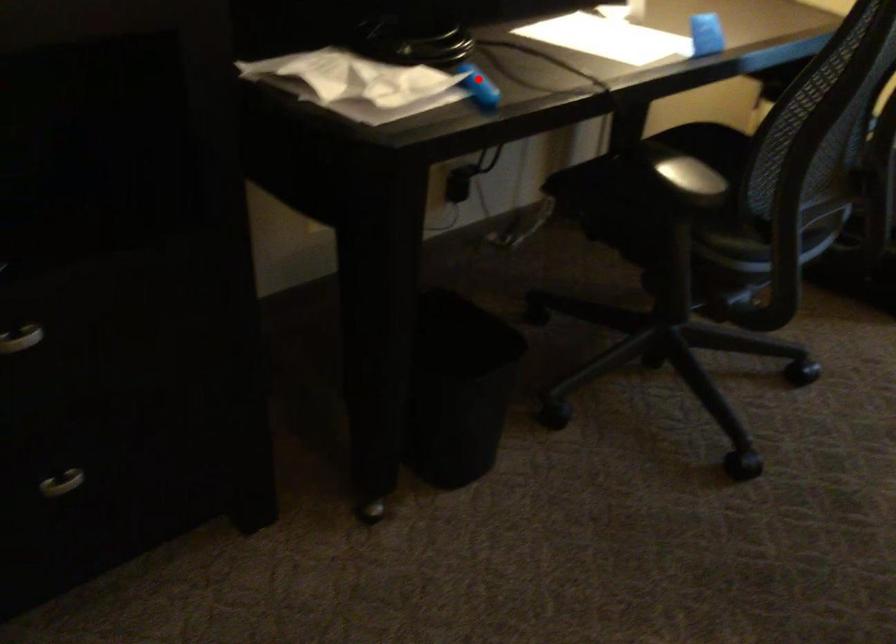
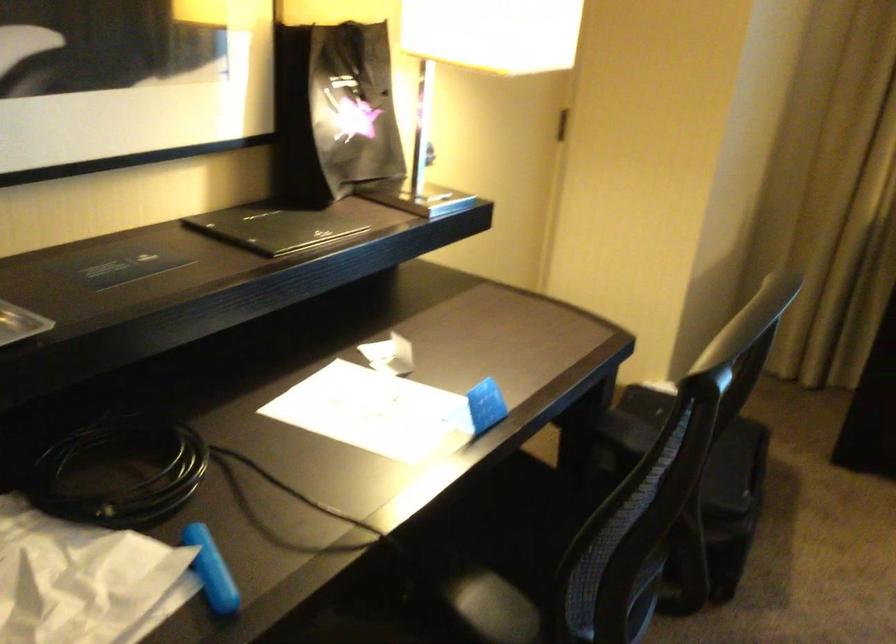
The point at the highlighted location is marked in the first image. Where is the corresponding point in the second image?

(211, 570)